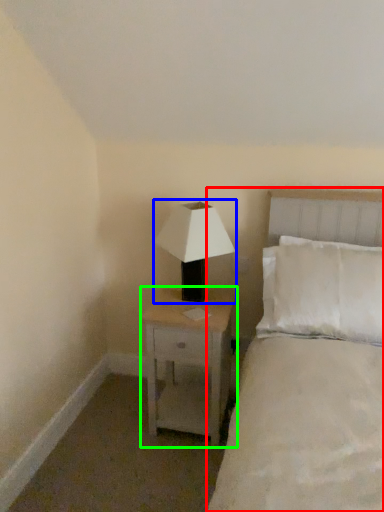
Question: Which is farther away from bed (highlighted by a red box)? lamp (highlighted by a blue box) or nightstand (highlighted by a green box)?

Choices:
 (A) lamp
 (B) nightstand

Answer: (A)